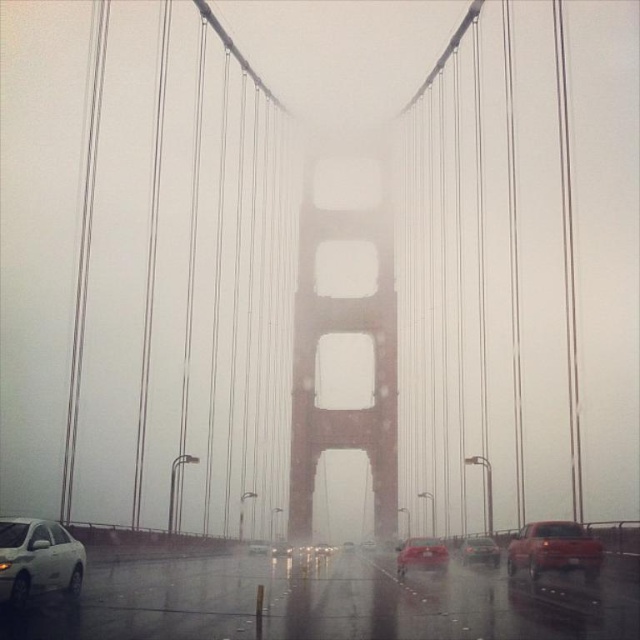
Looking at this image, you are a photographer standing at the camera position in the scene. You want to capture a closeup shot of the white glossy sedan at lower left. Can you estimate how far you need to walk forward to get closer to it?

The white glossy sedan at lower left is 53.57 meters away from the camera. To get a closeup shot, you would need to move closer to the sedan, but the exact distance to walk forward depends on your desired framing and lens focal length. However, the current distance is 53.57 meters.

You are driving a car and want to pass through the metallic silver car at center. Which direction should you move your car to avoid the matte red truck at right?

You should move to the left to avoid the matte red truck at right, since the matte red truck at right is positioned to the right of the metallic silver car at center.

You are a photographer trying to capture the Golden Gate Bridge in fog. You notice a white glossy sedan at lower left and a metallic silver sedan at center in your frame. Which car takes up more space in the photo?

The metallic silver sedan at center occupies more space in the photo than the white glossy sedan at lower left.